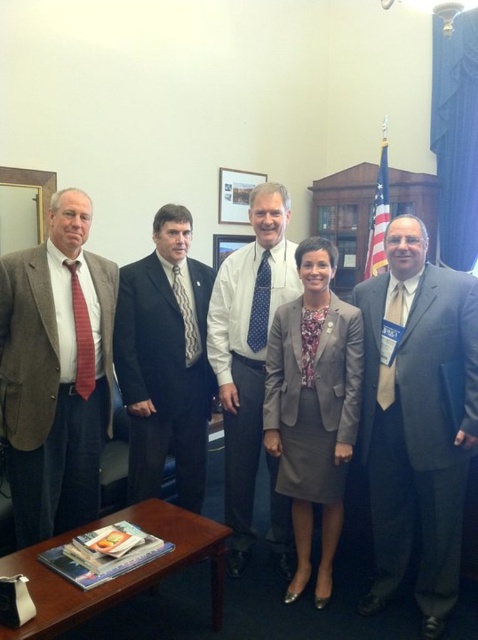
Question: Considering the real-world distances, which object is closest to the blue dotted tie at center?

Choices:
 (A) dark gray suit at center
 (B) gray wool suit at right

Answer: (A)

Question: Which point is closer to the camera?

Choices:
 (A) (278, 476)
 (B) (95, 442)
 (C) (424, 300)

Answer: (C)

Question: Can you confirm if blue dotted tie at center is smaller than dark gray suit at center?

Choices:
 (A) no
 (B) yes

Answer: (A)

Question: In this image, where is gray wool suit at right located relative to matte brown suit at left?

Choices:
 (A) right
 (B) left

Answer: (A)

Question: Considering the relative positions of gray wool suit at right and blue dotted tie at center in the image provided, where is gray wool suit at right located with respect to blue dotted tie at center?

Choices:
 (A) right
 (B) left

Answer: (A)

Question: Which object appears closest to the camera in this image?

Choices:
 (A) gray wool suit at right
 (B) dark gray suit at center
 (C) matte gray blazer at center
 (D) matte brown suit at left

Answer: (A)